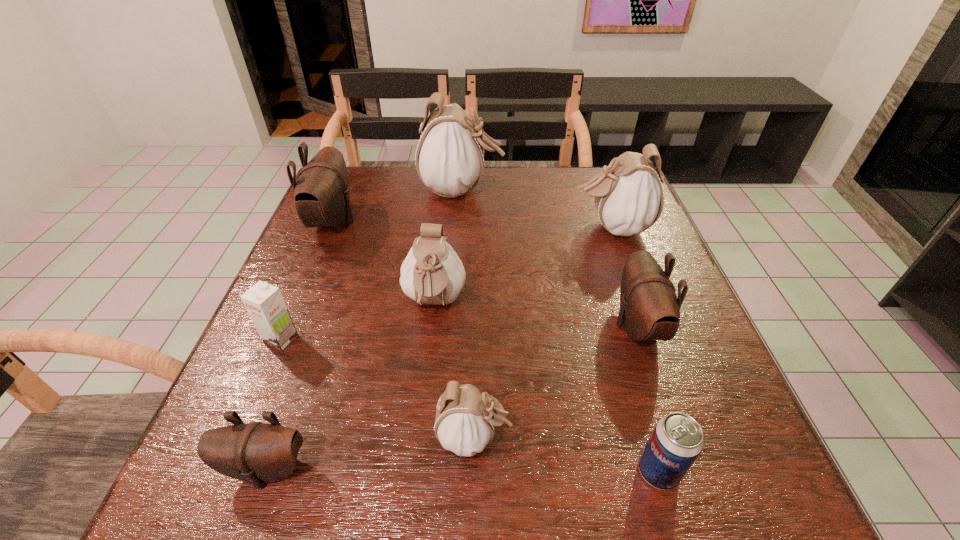
The image size is (960, 540). What are the coordinates of `the tallest object` in the screenshot? It's located at (449, 157).

Image resolution: width=960 pixels, height=540 pixels. In order to click on the biggest white pouch in this screenshot , I will do `click(449, 157)`.

At what (x,y) coordinates should I click in order to perform the action: click on the third smallest white pouch. Please return your answer as a coordinate pair (x, y). This screenshot has width=960, height=540. Looking at the image, I should click on (628, 195).

Locate an element on the screen. Image resolution: width=960 pixels, height=540 pixels. the biggest brown pouch is located at coordinates (322, 192).

Identify the location of the second smallest white pouch. The height and width of the screenshot is (540, 960). (432, 273).

You are a GUI agent. You are given a task and a screenshot of the screen. Output one action in this format:
    pyautogui.click(x=<x>, y=<y>)
    Task: Click on the second nearest brown pouch
    
    Given the screenshot: What is the action you would take?
    pyautogui.click(x=649, y=309)

Identify the location of the second biggest brown pouch. (649, 309).

Find the location of a particular element. This screenshot has height=540, width=960. chocolate milk is located at coordinates (264, 302).

Find the location of a particular element. the nearest white pouch is located at coordinates (464, 423).

Find the location of a particular element. The width and height of the screenshot is (960, 540). beer can is located at coordinates (677, 439).